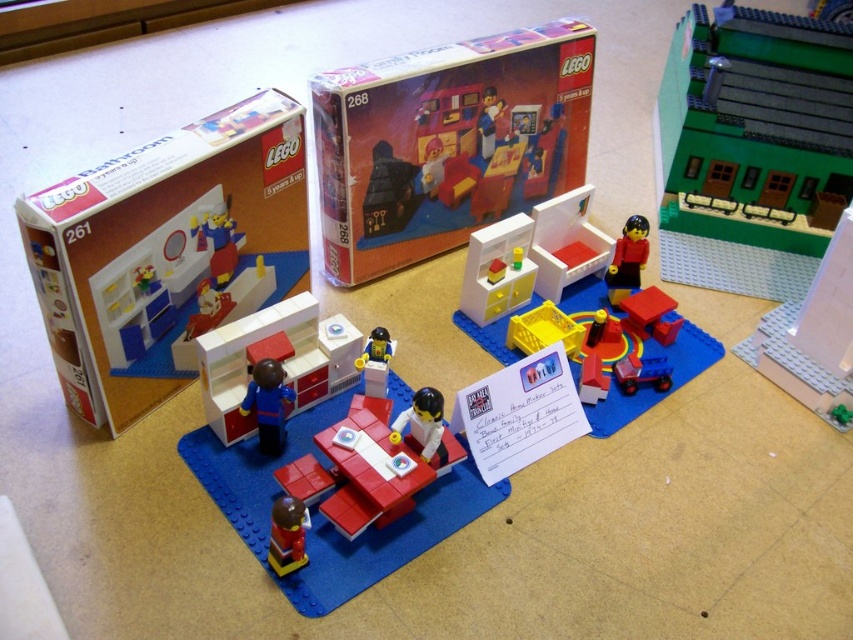
You are organizing a LEGO display and need to ensure that all minifigures are visible. The white plastic figure at center and the smooth plastic minifigure at center are placed on the same baseplate. Which one should you position closer to the front to ensure both are visible?

The white plastic figure at center is shorter than the smooth plastic minifigure at center, so you should position the white plastic figure at center closer to the front to ensure both are visible.

You are organizing a LEGO display and need to place the green plastic train at upper right and the matte white cabinet at center. According to the scene, where should you position them relative to each other?

The green plastic train at upper right should be placed above the matte white cabinet at center as per the scene description.